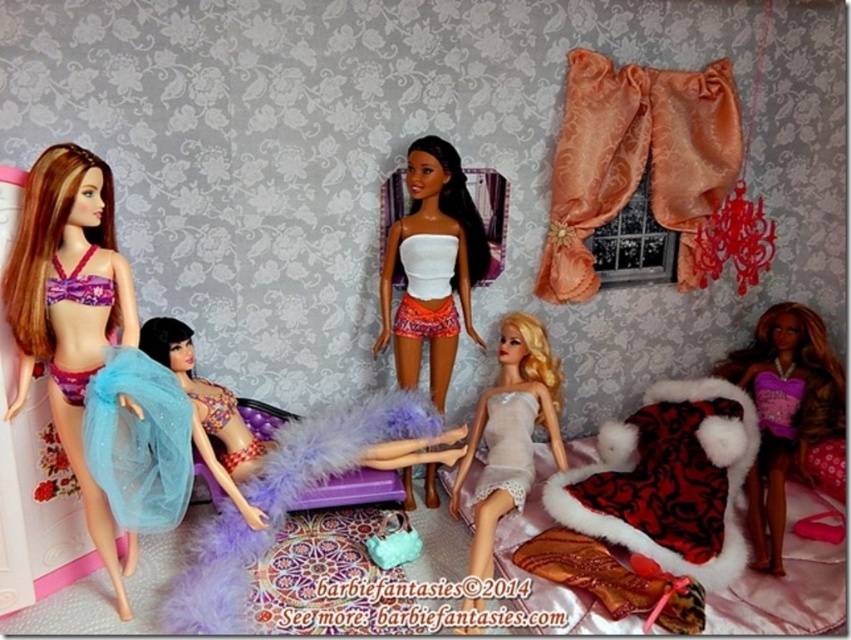
Question: Does purple sequined dress at lower right have a smaller size compared to white satin dress at center?

Choices:
 (A) yes
 (B) no

Answer: (B)

Question: Which object appears closest to the camera in this image?

Choices:
 (A) purple sequined dress at lower right
 (B) white satin dress at center

Answer: (B)

Question: Considering the real-world distances, which object is farthest from the red velvet stockings at lower right?

Choices:
 (A) purple sequined dress at lower right
 (B) white satin dress at center
 (C) matte purple bikini at left

Answer: (C)

Question: Can you confirm if white matte skirt at center is bigger than purple sequined dress at lower right?

Choices:
 (A) no
 (B) yes

Answer: (A)

Question: Can you confirm if white matte skirt at center is positioned below translucent blue fabric at center?

Choices:
 (A) no
 (B) yes

Answer: (A)

Question: Which of the following is the closest to the observer?

Choices:
 (A) white matte skirt at center
 (B) white satin dress at center

Answer: (B)